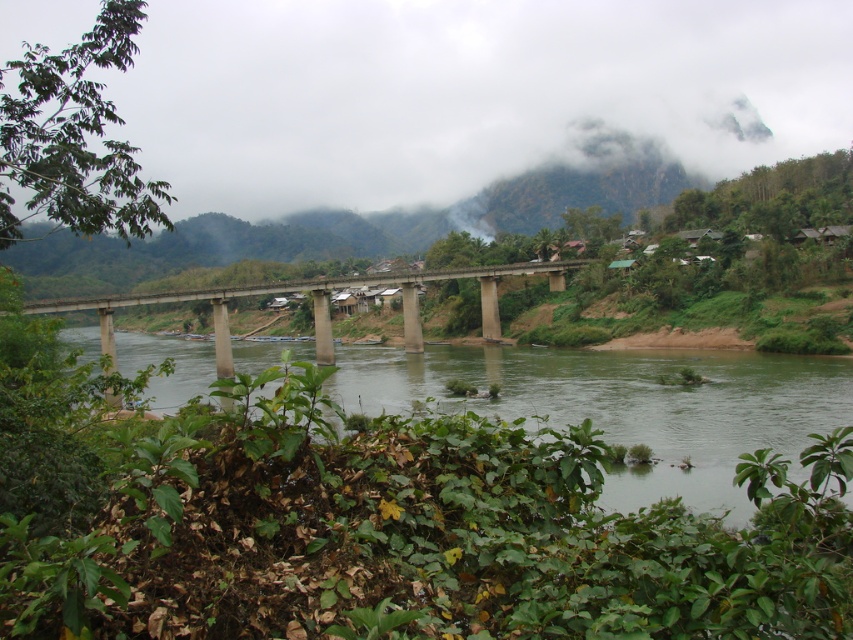
You are a hiker standing on the concrete bridge at center. You notice the green water at center flowing beneath you. From your current position, which object is closer to you?

The green water at center is closer to you because it is in front of the concrete bridge at center, meaning it is positioned nearer to your location on the bridge.

You are a landscape architect evaluating the river scene. You need to determine which object occupies a larger area in the image between the green water at center and the concrete bridge at center. Which one is it?

The green water at center is bigger than the concrete bridge at center, so the green water at center occupies a larger area in the image.